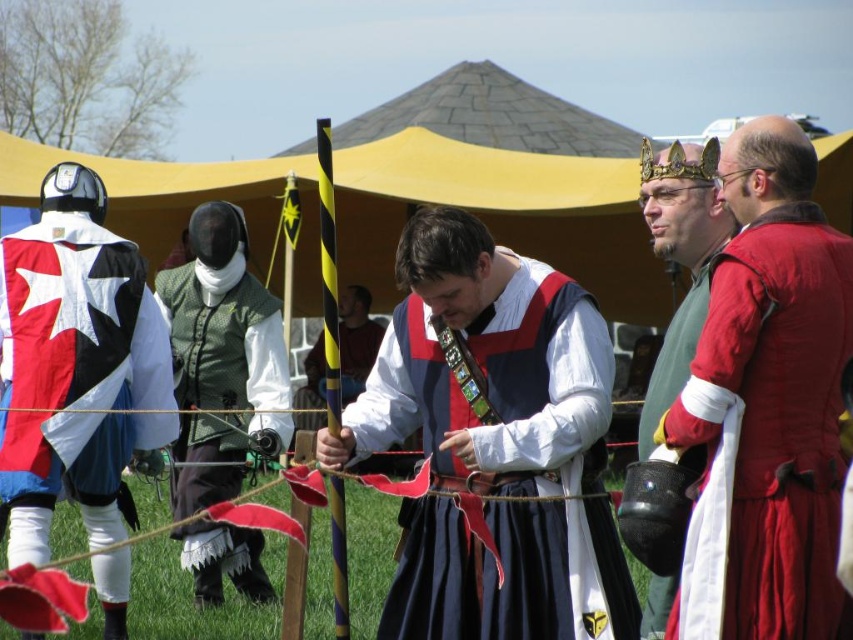
Question: Which of the following is the closest to the observer?

Choices:
 (A) (19, 336)
 (B) (405, 417)
 (C) (206, 372)

Answer: (B)

Question: Among these objects, which one is farthest from the camera?

Choices:
 (A) green textured vest at center
 (B) matte red vest at center

Answer: (A)

Question: Does matte red vest at center appear over matte yellow pole at center?

Choices:
 (A) no
 (B) yes

Answer: (B)

Question: Which object appears farthest from the camera in this image?

Choices:
 (A) green textured vest at center
 (B) red velvet tunic at right
 (C) matte yellow pole at center

Answer: (C)

Question: Considering the relative positions of red velvet tunic at right and green textured vest at center in the image provided, where is red velvet tunic at right located with respect to green textured vest at center?

Choices:
 (A) right
 (B) left

Answer: (A)

Question: Can you confirm if green textured vest at center is positioned to the right of matte yellow pole at center?

Choices:
 (A) yes
 (B) no

Answer: (B)